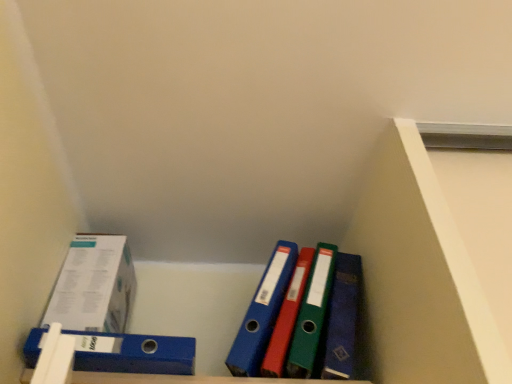
Question: From the image's perspective, is blue plastic binder at lower left positioned above or below white paperboard box at left?

Choices:
 (A) below
 (B) above

Answer: (A)

Question: Do you think blue plastic binder at lower left is within white paperboard box at left, or outside of it?

Choices:
 (A) outside
 (B) inside

Answer: (A)

Question: Considering the relative positions of blue plastic binder at lower left and white paperboard box at left in the image provided, is blue plastic binder at lower left to the left or to the right of white paperboard box at left?

Choices:
 (A) left
 (B) right

Answer: (B)

Question: Is point (77, 274) positioned closer to the camera than point (188, 357)?

Choices:
 (A) closer
 (B) farther

Answer: (B)

Question: Considering the positions of white paperboard box at left and blue plastic binder at lower left in the image, is white paperboard box at left taller or shorter than blue plastic binder at lower left?

Choices:
 (A) tall
 (B) short

Answer: (A)

Question: From a real-world perspective, is white paperboard box at left above or below blue plastic binder at lower left?

Choices:
 (A) below
 (B) above

Answer: (B)

Question: Is white paperboard box at left situated inside blue plastic binder at lower left or outside?

Choices:
 (A) inside
 (B) outside

Answer: (B)